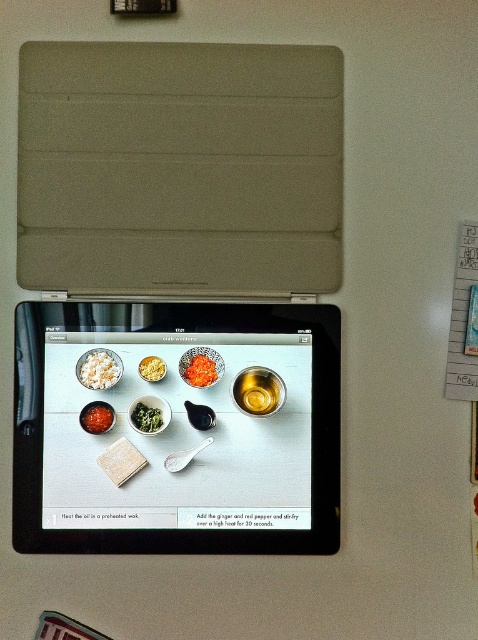
Where is the black glossy tablet at center located in the coordinate system?

The black glossy tablet at center is located at point (178, 429).

You are trying to reach for the bright red paste at center while holding the black plastic tablet at center. Can you move the tablet to access the paste?

The black plastic tablet at center is in front of the bright red paste at center, so you can move the tablet out of the way to access the paste.